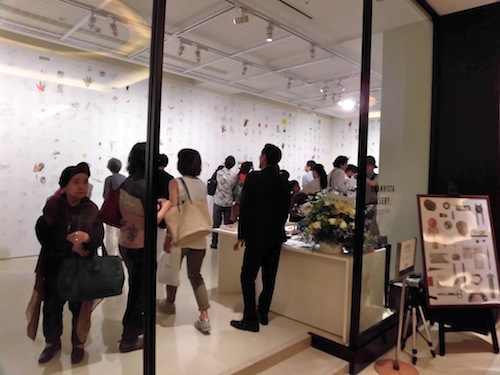
I want to click on display board, so click(460, 248).